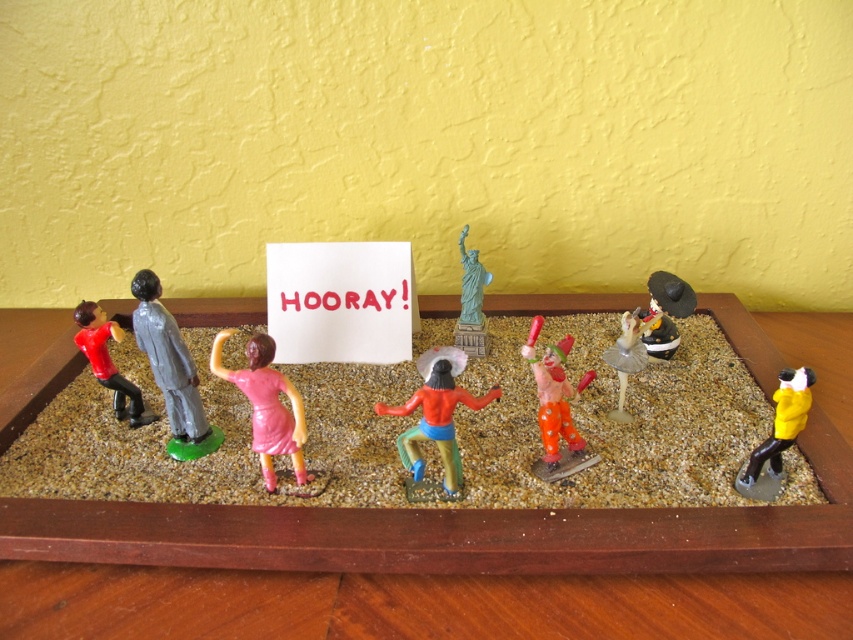
Looking at this image, who is positioned more to the left, matte plastic cowboy at center or matte black clown at center?

Positioned to the left is matte plastic cowboy at center.

In the scene shown: Can you confirm if matte plastic cowboy at center is wider than matte black clown at center?

Correct, the width of matte plastic cowboy at center exceeds that of matte black clown at center.

Which is behind, point (450, 456) or point (660, 340)?

Point (660, 340)

This screenshot has height=640, width=853. Identify the location of matte plastic cowboy at center. point(436,413).

Does white paper at center have a greater width compared to yellow matte figure at lower right?

Yes.

Who is more distant from viewer, (322, 269) or (747, 490)?

Positioned behind is point (322, 269).

Locate an element on the screen. The height and width of the screenshot is (640, 853). white paper at center is located at coordinates (341, 301).

Between white paper at center and matte plastic statue at center, which one is positioned higher?

matte plastic statue at center is higher up.

Measure the distance between point (357, 348) and camera.

Point (357, 348) is 1.30 meters away from camera.

Between point (302, 358) and point (473, 250), which one is positioned behind?

Positioned behind is point (302, 358).

Find the location of a particular element. white paper at center is located at coordinates (341, 301).